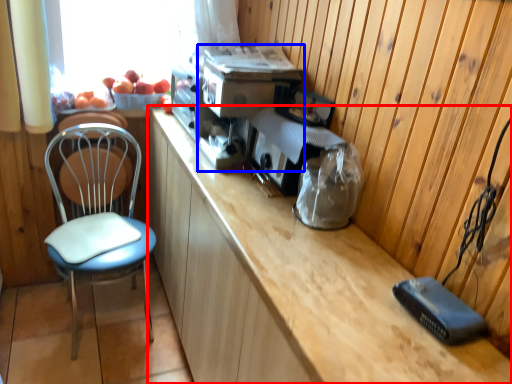
Question: Which object appears closest to the camera in this image, cabinetry (highlighted by a red box) or appliance (highlighted by a blue box)?

Choices:
 (A) cabinetry
 (B) appliance

Answer: (A)